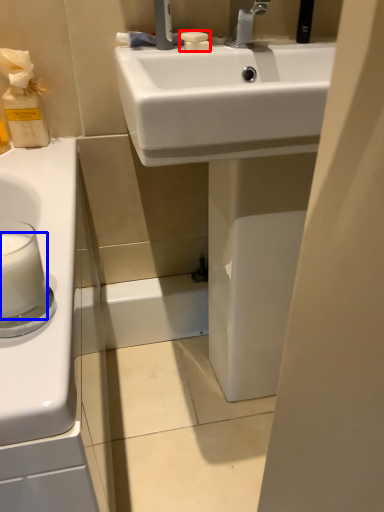
Question: Among these objects, which one is nearest to the camera, soap (highlighted by a red box) or milk (highlighted by a blue box)?

Choices:
 (A) soap
 (B) milk

Answer: (B)